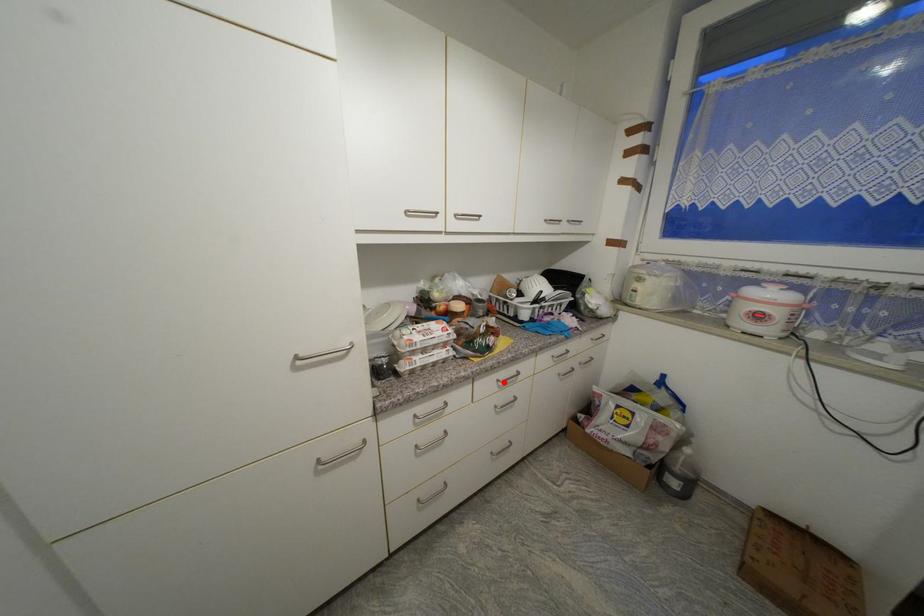
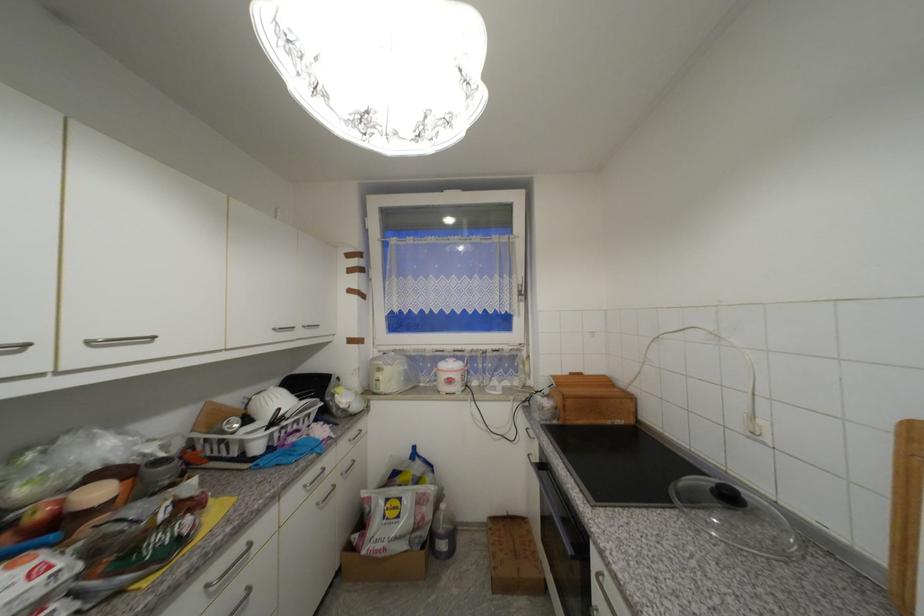
Where in the second image is the point corresponding to the highlighted location from the first image?

(213, 588)